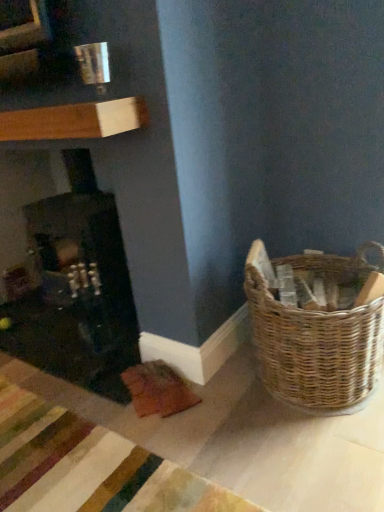
Identify the location of free spot to the left of woven brown basket at lower right. The width and height of the screenshot is (384, 512). (215, 420).